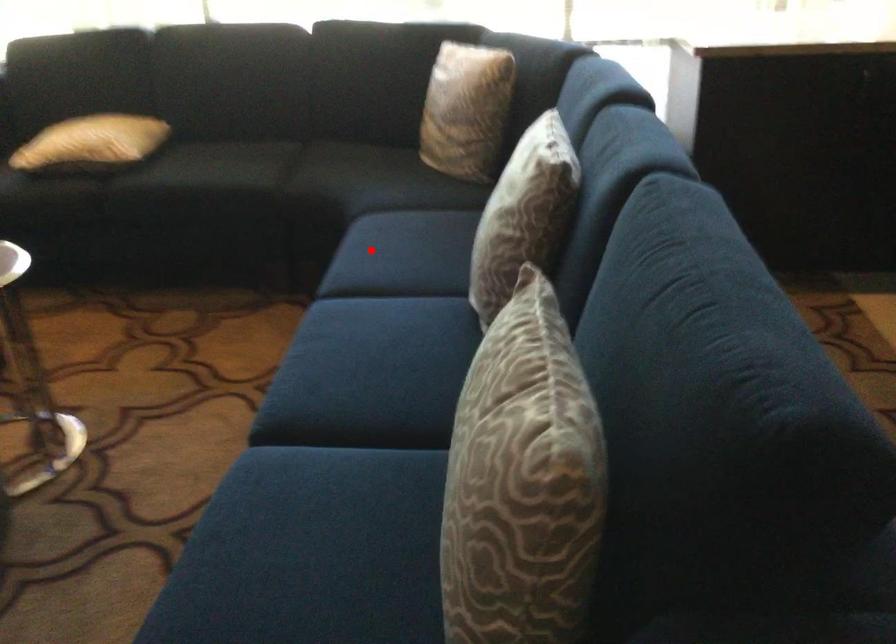
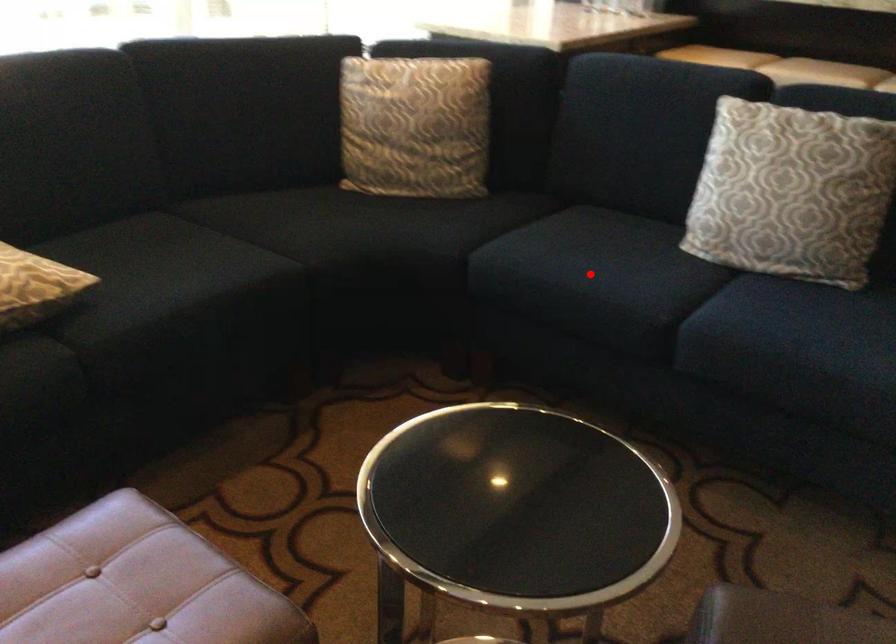
I am providing you with two images of the same scene from different viewpoints. A red point is marked on the first image and another point is marked on the second image. Are the points marked in image1 and image2 representing the same 3D position?

Yes